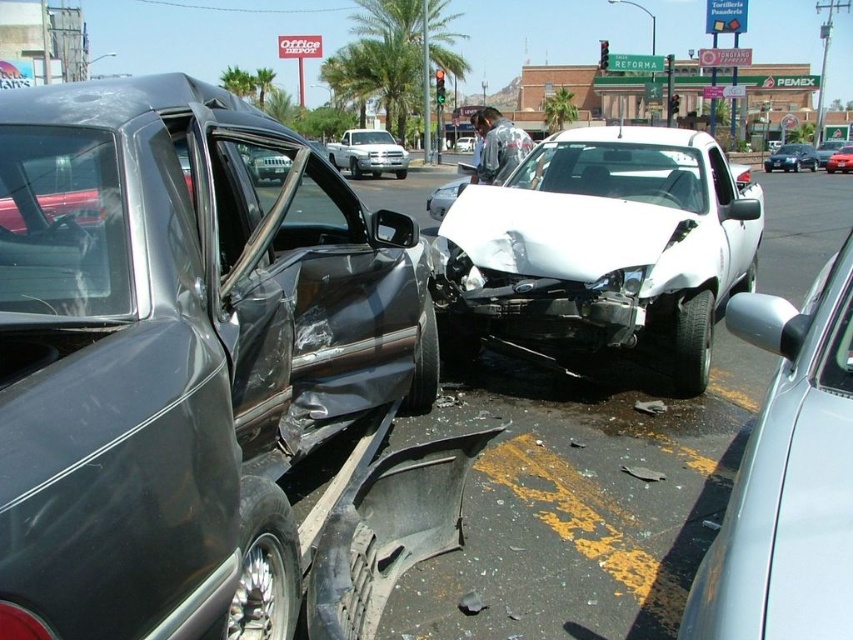
You are a tow truck operator who needs to tow both vehicles. The matte black car at left is narrower than the silver metallic pickup truck at center. Which vehicle should you tow first if you can only tow one at a time and want to clear the narrowest vehicle first to improve traffic flow?

You should tow the matte black car at left first because it is narrower than the silver metallic pickup truck at center, making it easier to clear the road and improve traffic flow.

You are a pedestrian standing on the sidewalk observing the accident. Which vehicle, the matte black car at left or the silver metallic pickup truck at center, is nearer to you?

The matte black car at left is closer to the viewer than the silver metallic pickup truck at center, so the matte black car at left is nearer to you.

You are a traffic officer assessing the accident scene. There is a point marked at coordinates (367,154). What vehicle is located at this point?

The point at coordinates (367,154) indicates the silver metallic pickup truck at center.